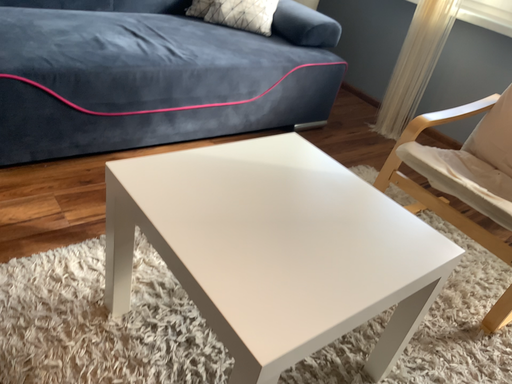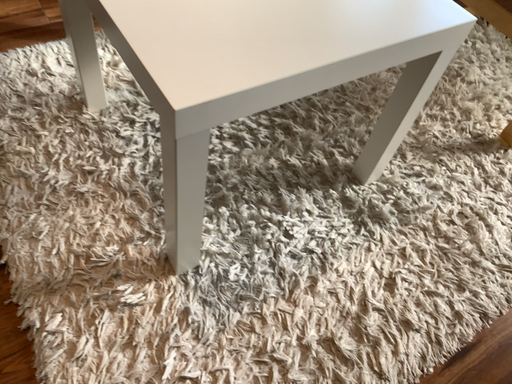
Question: Which way did the camera rotate in the video?

Choices:
 (A) rotated downward
 (B) rotated upward

Answer: (A)